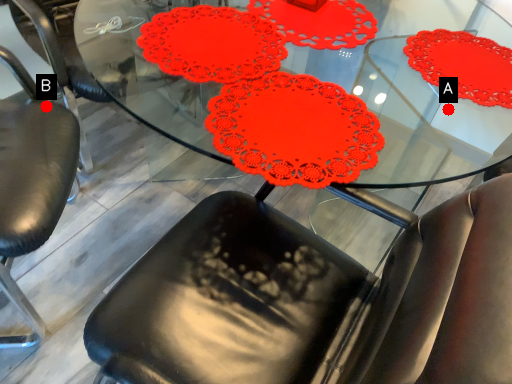
Question: Two points are circled on the image, labeled by A and B beside each circle. Which point is closer to the camera?

Choices:
 (A) A is closer
 (B) B is closer

Answer: (B)